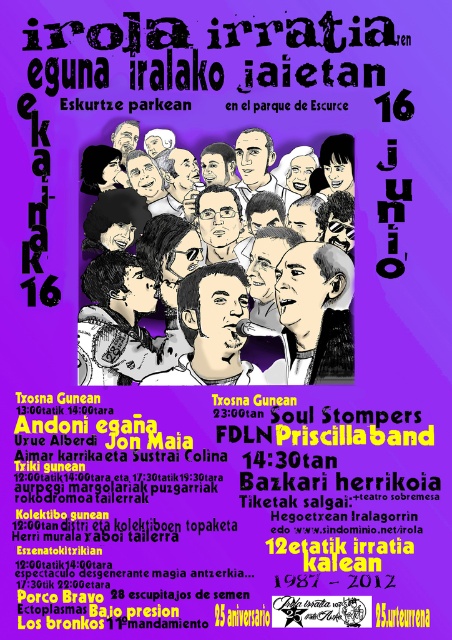
You are designing a layout for a radio event poster and need to place two elements, the black ink drawing of man at center and the matte black microphone at center. According to the provided image, which element is positioned to the right of the other?

The matte black microphone at center is positioned to the right of the black ink drawing of man at center.

Looking at the vibrant poster for the Irola Irratia event, you notice two depictions of men at the center. The first is a gray hair pencil sketch of man at center, and the second is a black ink drawing of man at center. Which one is positioned lower on the poster?

The gray hair pencil sketch of man at center is positioned lower because it is below the black ink drawing of man at center.